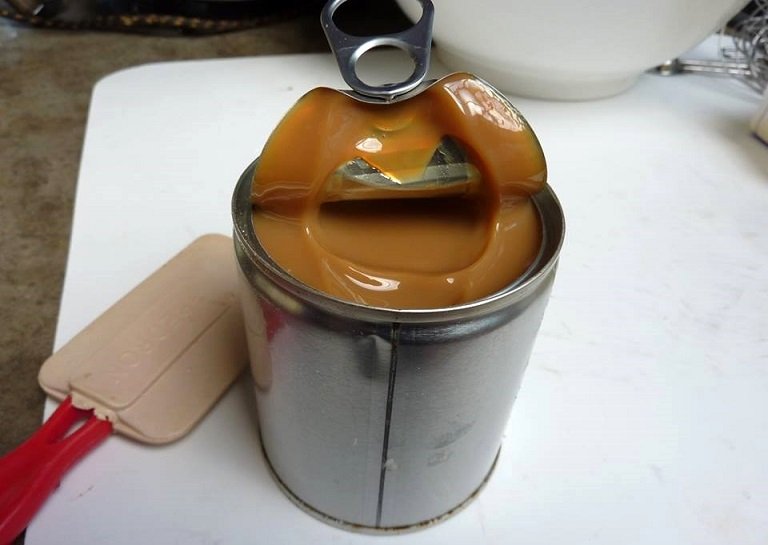
The height and width of the screenshot is (545, 768). I want to click on bowl, so click(x=611, y=41).